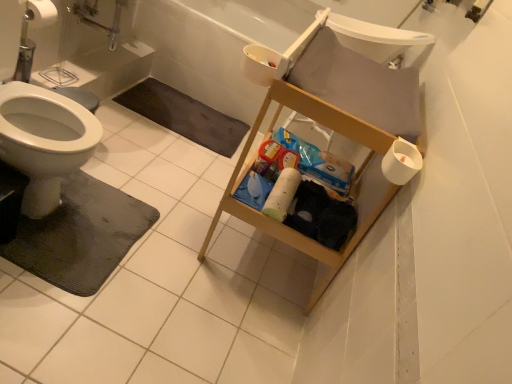
This screenshot has height=384, width=512. Identify the location of vacant space to the right of black rubber bath mat at lower left, which ranks as the second bath mat in back-to-front order. (182, 278).